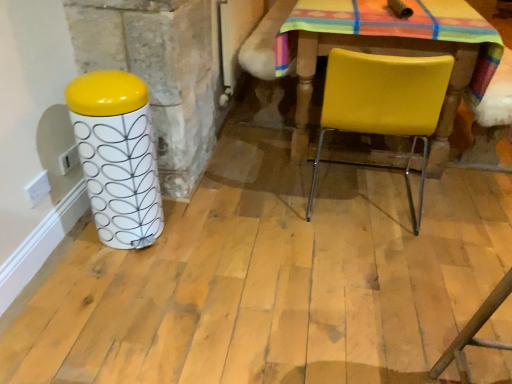
This screenshot has width=512, height=384. What do you see at coordinates (384, 104) in the screenshot? I see `yellow leather chair at center` at bounding box center [384, 104].

Find the location of a particular element. Image resolution: width=512 pixels, height=384 pixels. yellow leather chair at center is located at coordinates (384, 104).

What is the approximate width of yellow leather chair at center?

20.94 inches.

Measure the distance between yellow leather chair at center and camera.

yellow leather chair at center and camera are 1.51 meters apart from each other.

You are a GUI agent. You are given a task and a screenshot of the screen. Output one action in this format:
    pyautogui.click(x=<x>, y=<y>)
    Task: Click on the white glossy patterned canister at left
    
    Given the screenshot: What is the action you would take?
    pyautogui.click(x=117, y=156)

Describe the element at coordinates (117, 156) in the screenshot. I see `white glossy patterned canister at left` at that location.

What is the approximate width of white glossy patterned canister at left?

white glossy patterned canister at left is 11.85 inches wide.

Where is `yellow leather chair at center`? The width and height of the screenshot is (512, 384). yellow leather chair at center is located at coordinates (384, 104).

Between yellow leather chair at center and white glossy patterned canister at left, which one appears on the left side from the viewer's perspective?

Positioned to the left is white glossy patterned canister at left.

Considering the relative positions of yellow leather chair at center and white glossy patterned canister at left in the image provided, is yellow leather chair at center in front of white glossy patterned canister at left?

No, it is not.

Is point (362, 117) behind point (86, 165)?

Yes, it is behind point (86, 165).

From the image's perspective, between yellow leather chair at center and white glossy patterned canister at left, who is located below?

white glossy patterned canister at left, from the image's perspective.

From a real-world perspective, is yellow leather chair at center positioned above or below white glossy patterned canister at left?

Clearly, from a real-world perspective, yellow leather chair at center is above white glossy patterned canister at left.

Between yellow leather chair at center and white glossy patterned canister at left, which one has smaller width?

white glossy patterned canister at left.

Can you confirm if yellow leather chair at center is taller than white glossy patterned canister at left?

Yes.

Is yellow leather chair at center smaller than white glossy patterned canister at left?

No, yellow leather chair at center is not smaller than white glossy patterned canister at left.

Is yellow leather chair at center not inside white glossy patterned canister at left?

That's correct, yellow leather chair at center is outside of white glossy patterned canister at left.

Would you say yellow leather chair at center is a long distance from white glossy patterned canister at left?

yellow leather chair at center is actually quite close to white glossy patterned canister at left.

Is yellow leather chair at center facing away from white glossy patterned canister at left?

No, yellow leather chair at center is not facing away from white glossy patterned canister at left.

How distant is yellow leather chair at center from white glossy patterned canister at left?

yellow leather chair at center and white glossy patterned canister at left are 34.53 inches apart from each other.

Identify the location of pillar on the left of yellow leather chair at center. (117, 156).

In the image, is white glossy patterned canister at left on the left side or the right side of yellow leather chair at center?

white glossy patterned canister at left is to the left of yellow leather chair at center.

Which object is closer to the camera, white glossy patterned canister at left or yellow leather chair at center?

white glossy patterned canister at left is more forward.

Considering the points (106, 128) and (345, 102), which point is behind, point (106, 128) or point (345, 102)?

The point (345, 102) is more distant.

From the image's perspective, between white glossy patterned canister at left and yellow leather chair at center, which one is located above?

From the image's view, yellow leather chair at center is above.

From a real-world perspective, which is physically below, white glossy patterned canister at left or yellow leather chair at center?

white glossy patterned canister at left, from a real-world perspective.

Is white glossy patterned canister at left wider or thinner than yellow leather chair at center?

Considering their sizes, white glossy patterned canister at left looks slimmer than yellow leather chair at center.

Between white glossy patterned canister at left and yellow leather chair at center, which one has more height?

yellow leather chair at center.

Looking at this image, does white glossy patterned canister at left have a smaller size compared to yellow leather chair at center?

Correct, white glossy patterned canister at left occupies less space than yellow leather chair at center.

Is white glossy patterned canister at left situated inside yellow leather chair at center or outside?

white glossy patterned canister at left is not inside yellow leather chair at center, it's outside.

Is white glossy patterned canister at left not near yellow leather chair at center?

No, white glossy patterned canister at left is not far from yellow leather chair at center.

Is white glossy patterned canister at left looking in the opposite direction of yellow leather chair at center?

That's not correct — white glossy patterned canister at left is not looking away from yellow leather chair at center.

How different are the orientations of white glossy patterned canister at left and yellow leather chair at center in degrees?

They differ by 88.8 degrees in their facing directions.

In the image, there is a yellow leather chair at center. Where is `pillar below it (from the image's perspective)`? This screenshot has width=512, height=384. pillar below it (from the image's perspective) is located at coordinates (117, 156).

Find the location of a particular element. The height and width of the screenshot is (384, 512). pillar located on the left of yellow leather chair at center is located at coordinates (117, 156).

This screenshot has width=512, height=384. Identify the location of chair that appears above the white glossy patterned canister at left (from a real-world perspective). (384, 104).